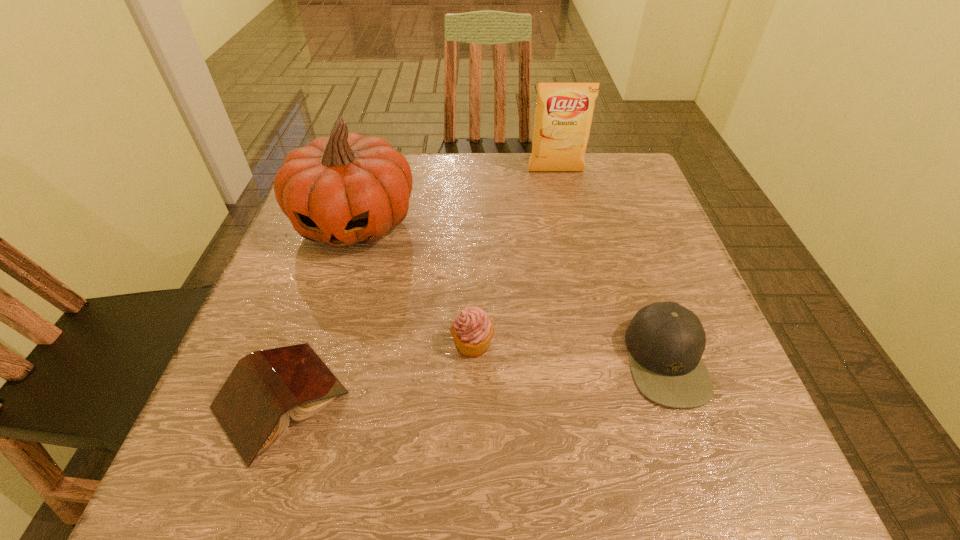
Find the location of a particular element. This screenshot has width=960, height=540. object positioned at the near left corner is located at coordinates (253, 406).

At what (x,y) coordinates should I click in order to perform the action: click on object at the far right corner. Please return your answer as a coordinate pair (x, y). This screenshot has height=540, width=960. Looking at the image, I should click on click(563, 116).

This screenshot has width=960, height=540. In the image, there is a desktop. What are the coordinates of `free region at the far edge` in the screenshot? It's located at (416, 177).

I want to click on free space at the near edge of the desktop, so click(x=435, y=475).

Where is `vacant space at the left edge`? This screenshot has height=540, width=960. vacant space at the left edge is located at coordinates (331, 318).

This screenshot has width=960, height=540. I want to click on free point at the near left corner, so click(x=225, y=487).

You are a GUI agent. You are given a task and a screenshot of the screen. Output one action in this format:
    pyautogui.click(x=<x>, y=<y>)
    Task: Click on the vacant position at the far right corner of the desktop
    Image resolution: width=960 pixels, height=540 pixels.
    Given the screenshot: What is the action you would take?
    pyautogui.click(x=583, y=179)

At what (x,y) coordinates should I click in order to perform the action: click on vacant space that's between the second farthest object and the third object from right to left. Please return your answer as a coordinate pair (x, y). The width and height of the screenshot is (960, 540). Looking at the image, I should click on (414, 282).

Image resolution: width=960 pixels, height=540 pixels. What are the coordinates of `vacant area that lies between the book and the cupcake` in the screenshot? It's located at (376, 372).

Identify the location of blank region between the third object from left to right and the crisp (potato chip). The width and height of the screenshot is (960, 540). (515, 257).